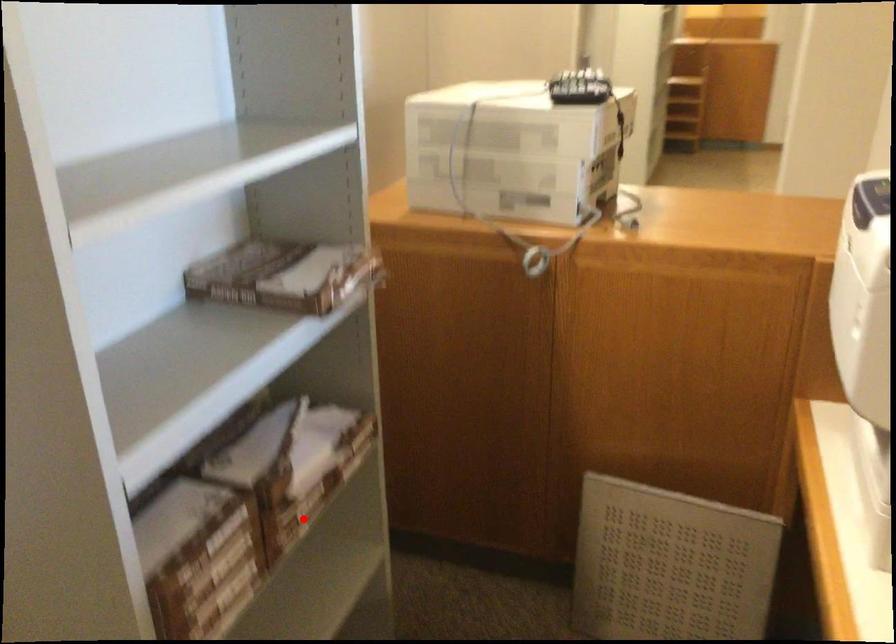
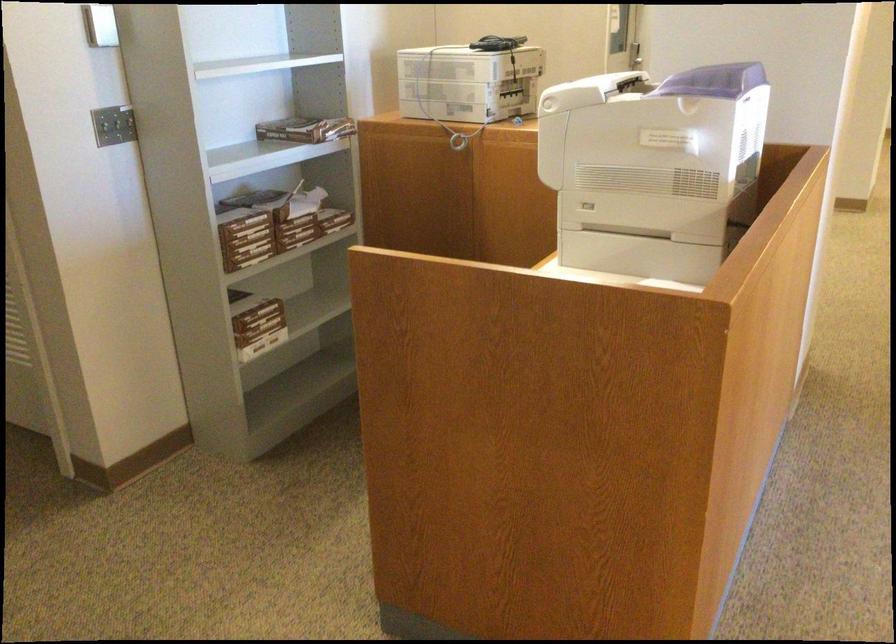
In the second image, find the point that corresponds to the highlighted location in the first image.

(297, 231)